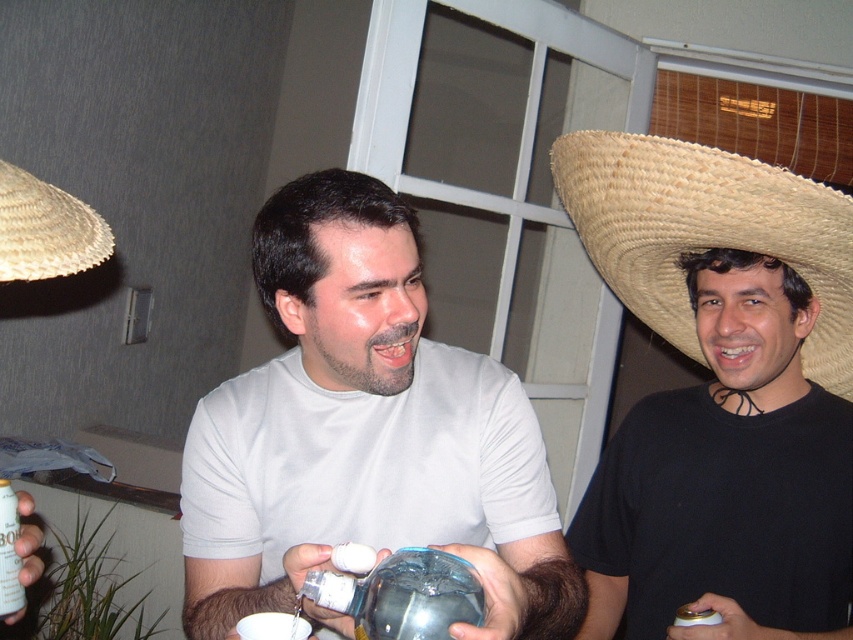
Question: Does transparent plastic bottle at center appear under beige straw sombrero at upper left?

Choices:
 (A) no
 (B) yes

Answer: (B)

Question: Is straw woven sombrero at upper right positioned before beige straw sombrero at upper left?

Choices:
 (A) no
 (B) yes

Answer: (A)

Question: Which of the following is the closest to the observer?

Choices:
 (A) (405, 486)
 (B) (19, 230)
 (C) (384, 637)

Answer: (C)

Question: Which point is farther to the camera?

Choices:
 (A) white matte shirt at center
 (B) metallic silver can at lower left
 (C) transparent plastic bottle at center

Answer: (B)

Question: Which object appears farthest from the camera in this image?

Choices:
 (A) beige straw sombrero at upper left
 (B) transparent plastic bottle at center
 (C) white matte shirt at center
 (D) straw woven sombrero at upper right

Answer: (D)

Question: Can you confirm if straw woven sombrero at upper right is positioned above metallic silver can at lower left?

Choices:
 (A) no
 (B) yes

Answer: (B)